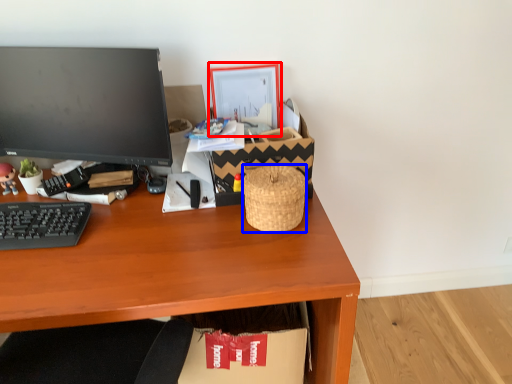
Question: Which point is further to the camera, picture frame (highlighted by a red box) or basket (highlighted by a blue box)?

Choices:
 (A) picture frame
 (B) basket

Answer: (A)